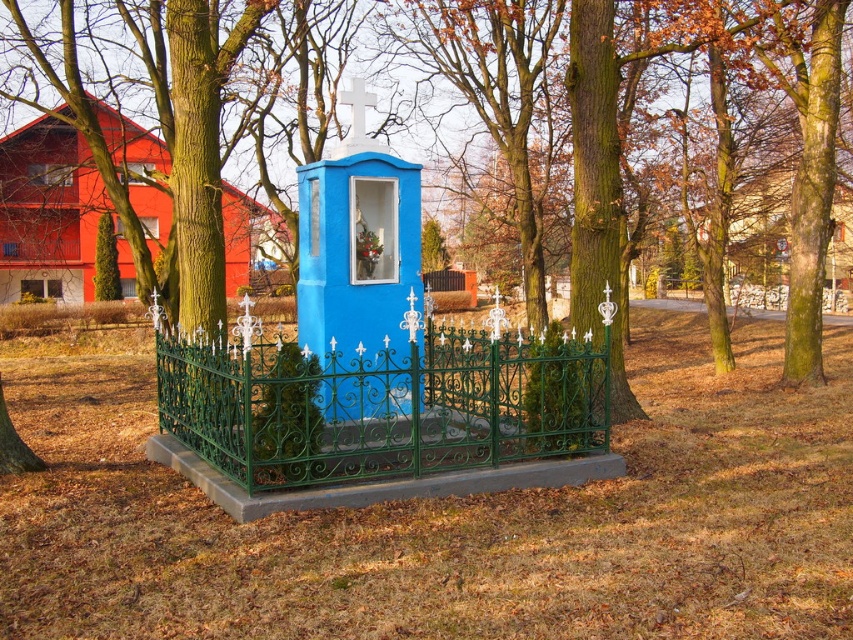
You are planning to place a new bench in the park. You have a bench that is 3 meters wide. The green textured fence at center and the blue painted wood gazebo at center are both in the way. Which structure do you need to move to accommodate the bench?

The green textured fence at center is wider than the blue painted wood gazebo at center. Therefore, you need to move the green textured fence at center to accommodate the 3 meters wide bench since it has more space to adjust.